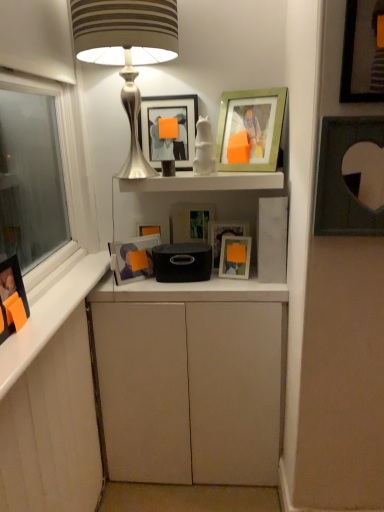
Image resolution: width=384 pixels, height=512 pixels. I want to click on free space above white matte counter top at lower left (from a real-world perspective), so click(x=54, y=291).